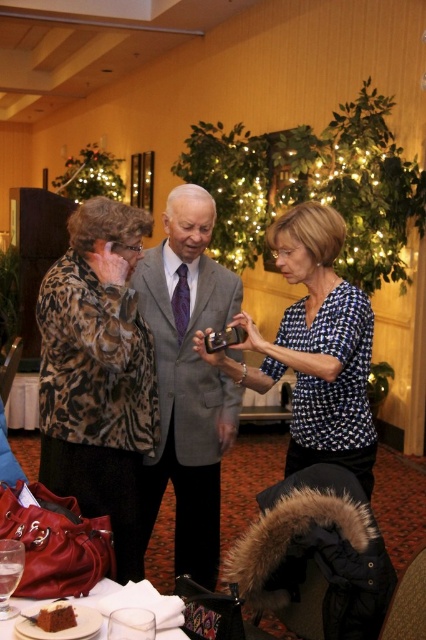
Is leopard print jacket at left bigger than chocolate cake at lower left?

Correct, leopard print jacket at left is larger in size than chocolate cake at lower left.

The image size is (426, 640). What do you see at coordinates (97, 372) in the screenshot?
I see `leopard print jacket at left` at bounding box center [97, 372].

You are a GUI agent. You are given a task and a screenshot of the screen. Output one action in this format:
    pyautogui.click(x=<x>, y=<y>)
    Task: Click on the leopard print jacket at left
    Image resolution: width=426 pixels, height=640 pixels.
    Given the screenshot: What is the action you would take?
    pyautogui.click(x=97, y=372)

Who is shorter, leopard print jacket at left or matte brown cake at lower left?

With less height is matte brown cake at lower left.

Does point (103, 305) come farther from viewer compared to point (163, 625)?

Yes.

Is point (134, 339) positioned after point (157, 634)?

That is True.

Locate an element on the screen. The width and height of the screenshot is (426, 640). leopard print jacket at left is located at coordinates (97, 372).

Consider the image. Who is lower down, blue dotted blouse at center or matte brown cake at lower left?

matte brown cake at lower left is lower down.

Looking at this image, who is more forward, [336,330] or [114,600]?

Point [114,600] is more forward.

What are the coordinates of `blue dotted blouse at center` in the screenshot? It's located at (314, 348).